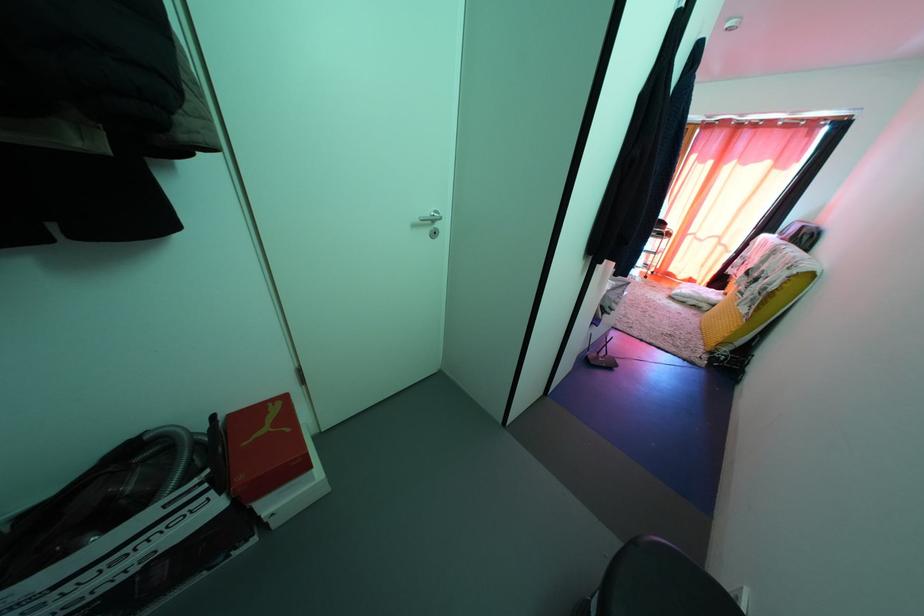
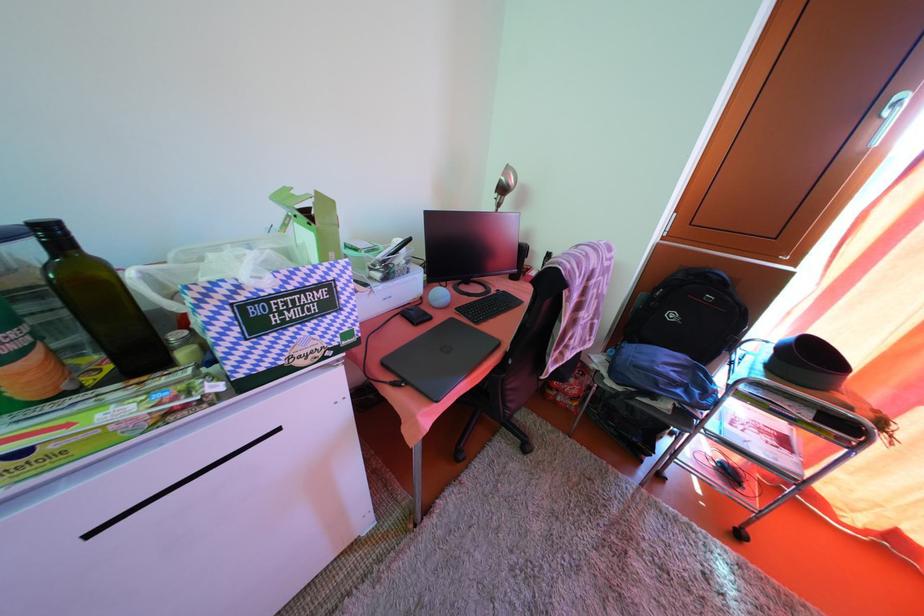
The images are taken continuously from a first-person perspective. In which direction are you moving?

The cameraman moved toward right, forward.